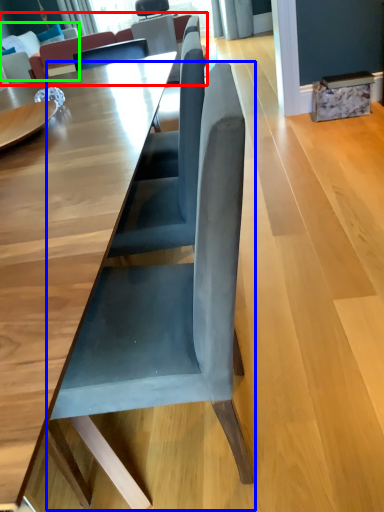
Question: Based on their relative distances, which object is nearer to couch (highlighted by a red box)? Choose from chair (highlighted by a blue box) and couch (highlighted by a green box).

Choices:
 (A) chair
 (B) couch

Answer: (B)